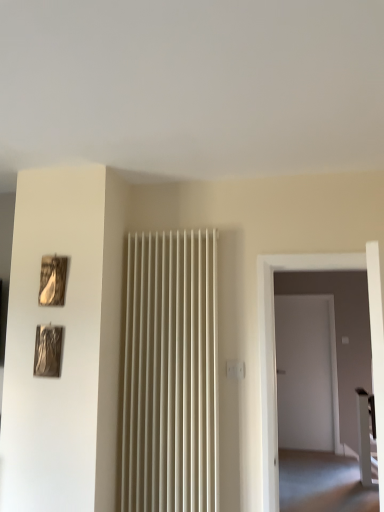
Question: Can you confirm if wooden matte picture frame at upper left, positioned as the 2th picture frame in bottom-to-top order, is wider than metallic silver picture frame at left, which is counted as the 1th picture frame, starting from the bottom?

Choices:
 (A) no
 (B) yes

Answer: (A)

Question: Could you tell me if wooden matte picture frame at upper left, positioned as the 2th picture frame in bottom-to-top order, is facing metallic silver picture frame at left, which is counted as the 1th picture frame, starting from the bottom?

Choices:
 (A) no
 (B) yes

Answer: (A)

Question: Is wooden matte picture frame at upper left, which is the first picture frame from top to bottom, further to camera compared to metallic silver picture frame at left, marked as the second picture frame in a top-to-bottom arrangement?

Choices:
 (A) no
 (B) yes

Answer: (B)

Question: Is wooden matte picture frame at upper left, positioned as the 2th picture frame in bottom-to-top order, facing away from metallic silver picture frame at left, which is counted as the 1th picture frame, starting from the bottom?

Choices:
 (A) yes
 (B) no

Answer: (B)

Question: From a real-world perspective, is wooden matte picture frame at upper left, positioned as the 2th picture frame in bottom-to-top order, on top of metallic silver picture frame at left, which is counted as the 1th picture frame, starting from the bottom?

Choices:
 (A) no
 (B) yes

Answer: (B)

Question: In terms of height, does white glossy table at right look taller or shorter compared to wooden matte picture frame at upper left, positioned as the 2th picture frame in bottom-to-top order?

Choices:
 (A) short
 (B) tall

Answer: (B)

Question: Is white glossy table at right to the left or to the right of wooden matte picture frame at upper left, which is the first picture frame from top to bottom, in the image?

Choices:
 (A) left
 (B) right

Answer: (B)

Question: Based on their sizes in the image, would you say white glossy table at right is bigger or smaller than wooden matte picture frame at upper left, which is the first picture frame from top to bottom?

Choices:
 (A) big
 (B) small

Answer: (A)

Question: Considering the positions of point (367, 407) and point (41, 257), is point (367, 407) closer or farther from the camera than point (41, 257)?

Choices:
 (A) farther
 (B) closer

Answer: (A)

Question: Looking at their shapes, would you say white glossy table at right is wider or thinner than metallic silver picture frame at left, which is counted as the 1th picture frame, starting from the bottom?

Choices:
 (A) thin
 (B) wide

Answer: (B)

Question: Considering the positions of point (360, 406) and point (49, 374), is point (360, 406) closer or farther from the camera than point (49, 374)?

Choices:
 (A) farther
 (B) closer

Answer: (A)

Question: Considering their positions, is white glossy table at right located in front of or behind metallic silver picture frame at left, marked as the second picture frame in a top-to-bottom arrangement?

Choices:
 (A) behind
 (B) front

Answer: (A)

Question: Looking at the image, does white glossy table at right seem bigger or smaller compared to metallic silver picture frame at left, which is counted as the 1th picture frame, starting from the bottom?

Choices:
 (A) big
 (B) small

Answer: (A)

Question: Is wooden matte picture frame at upper left, which is the first picture frame from top to bottom, wider or thinner than metallic silver picture frame at left, which is counted as the 1th picture frame, starting from the bottom?

Choices:
 (A) wide
 (B) thin

Answer: (B)

Question: Is wooden matte picture frame at upper left, positioned as the 2th picture frame in bottom-to-top order, taller or shorter than metallic silver picture frame at left, marked as the second picture frame in a top-to-bottom arrangement?

Choices:
 (A) tall
 (B) short

Answer: (B)